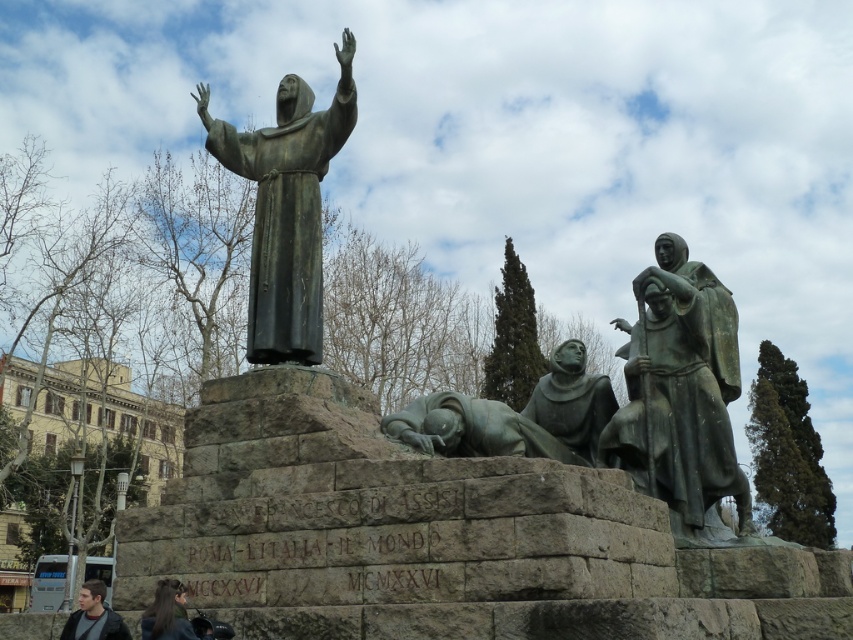
What is the relationship between the size of the green patina statue at center and the dark brown hair at lower left?

The green patina statue at center has a larger size compared to the dark brown hair at lower left.

What is the spatial relationship between the bronze statue at right and the bronze statue at upper center?

The bronze statue at right is positioned to the right of the bronze statue at upper center.

You are an art student analyzing the statues in the image. You notice the bronze statue at right and the bronze statue at upper center. Which of these two statues is wider?

The bronze statue at upper center is wider than the bronze statue at right.